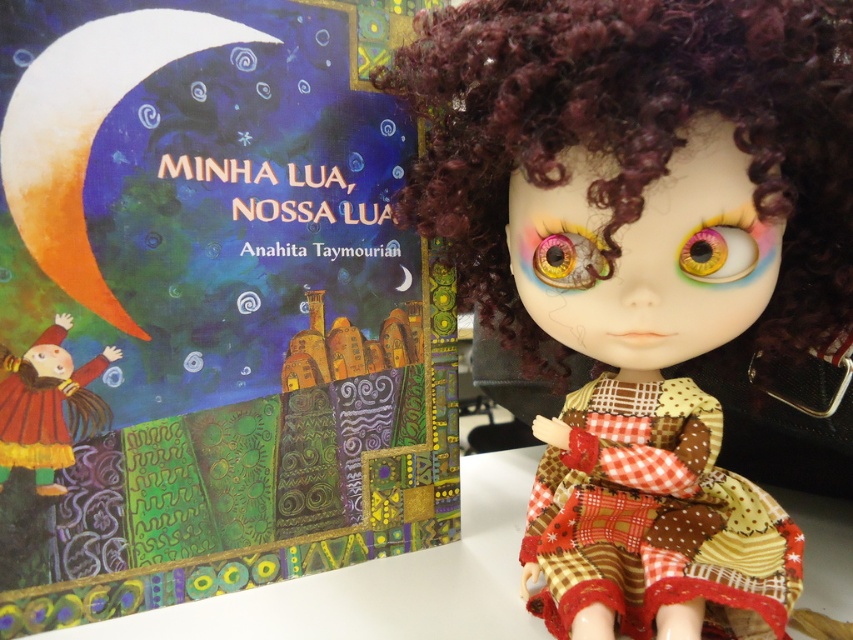
You are organizing a shelf and see the matte paper book at upper left and the matte yellow dress at lower left. Which item is positioned more to the right?

The matte paper book at upper left is positioned more to the right than the matte yellow dress at lower left.

You are an artist trying to sketch the scene. You notice the curly brown hair at upper right and the multicolored glass eye at center. Which object should you draw first to ensure proper layering?

You should draw the curly brown hair at upper right first because it is in front of the multicolored glass eye at center, so it needs to be layered on top.

You are organizing a shelf and need to place the matte paper book at upper left and the matte yellow dress at lower left. Since the book is in front of the dress, which one should you move first to access the other?

Since the matte paper book at upper left is in front of the matte yellow dress at lower left, you should move the matte paper book at upper left first to access the matte yellow dress at lower left.